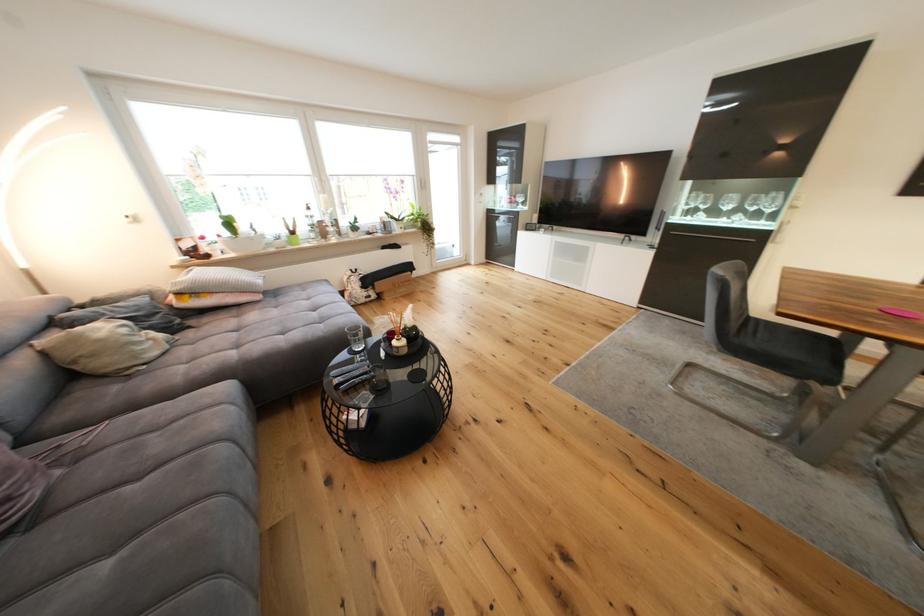
Where is `dark gray pillow`? The image size is (924, 616). dark gray pillow is located at coordinates (18, 485).